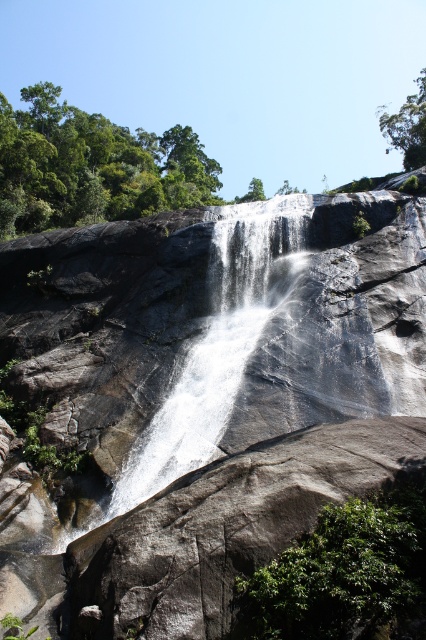
Question: Which of these objects is positioned closest to the green leafy tree at upper right?

Choices:
 (A) green leafy bush at lower right
 (B) gray rough rock at center

Answer: (B)

Question: Does gray rough rock at center appear over green leafy tree at upper right?

Choices:
 (A) no
 (B) yes

Answer: (A)

Question: Which of the following is the farthest from the observer?

Choices:
 (A) (20, 145)
 (B) (408, 148)
 (C) (258, 218)
 (D) (279, 620)

Answer: (B)

Question: Can you confirm if gray rough rock at center is positioned above green leafy trees at upper left?

Choices:
 (A) no
 (B) yes

Answer: (A)

Question: Which point is farther to the camera?

Choices:
 (A) gray rough rock at center
 (B) green leafy trees at upper left
 (C) green leafy bush at lower right
 (D) green leafy tree at upper right

Answer: (D)

Question: In this image, where is white smooth waterfall at center located relative to green leafy trees at upper left?

Choices:
 (A) above
 (B) below

Answer: (B)